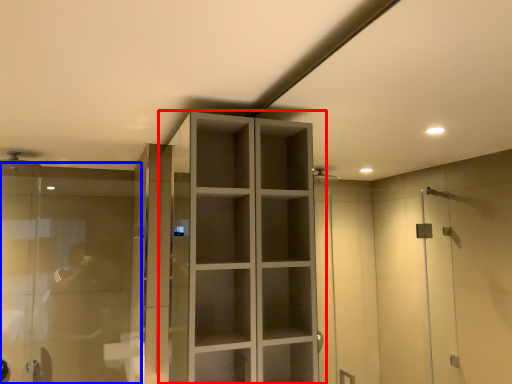
Question: Which object is further to the camera taking this photo, cupboard (highlighted by a red box) or glass door (highlighted by a blue box)?

Choices:
 (A) cupboard
 (B) glass door

Answer: (B)